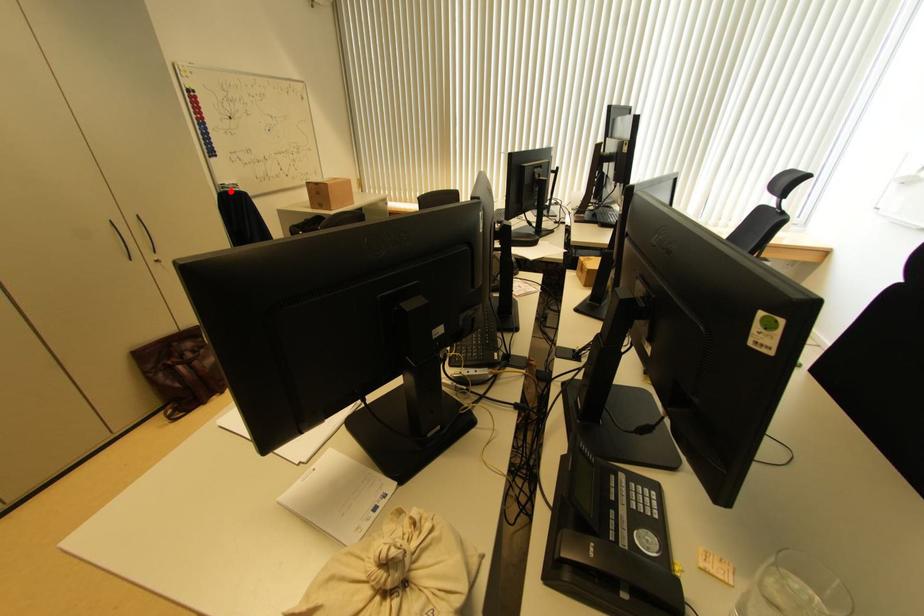
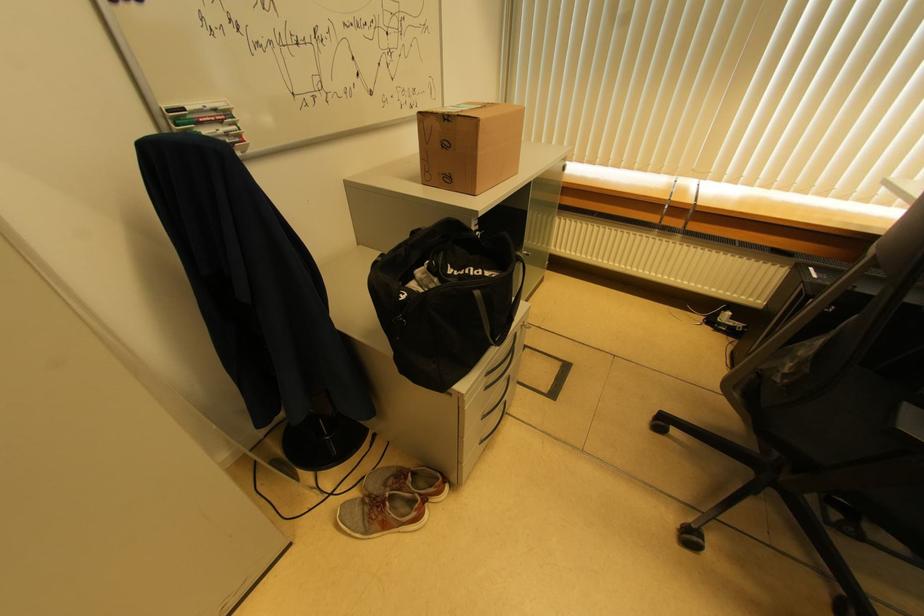
Where in the second image is the point corresponding to the highlighted location from the first image?

(201, 126)